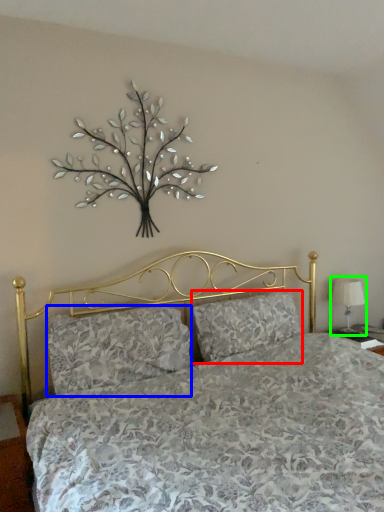
Question: Considering the real-world distances, which object is farthest from pillow (highlighted by a red box)? pillow (highlighted by a blue box) or table lamp (highlighted by a green box)?

Choices:
 (A) pillow
 (B) table lamp

Answer: (B)